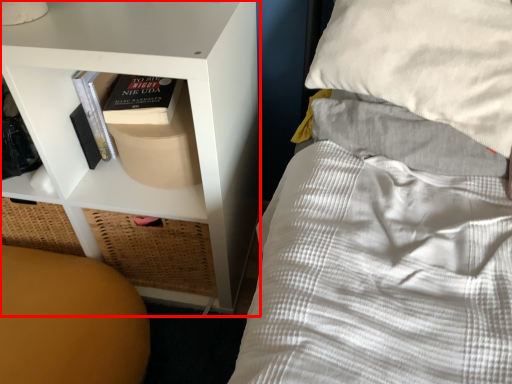
Question: From the image's perspective, what is the correct spatial positioning of shelf (annotated by the red box) in reference to furniture?

Choices:
 (A) below
 (B) above

Answer: (B)